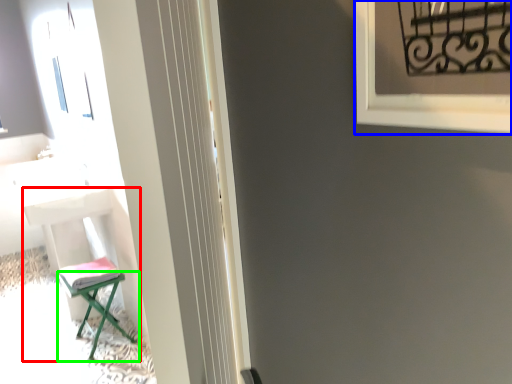
Question: Considering the real-world distances, which object is farthest from furniture (highlighted by a red box)? window frame (highlighted by a blue box) or furniture (highlighted by a green box)?

Choices:
 (A) window frame
 (B) furniture

Answer: (A)